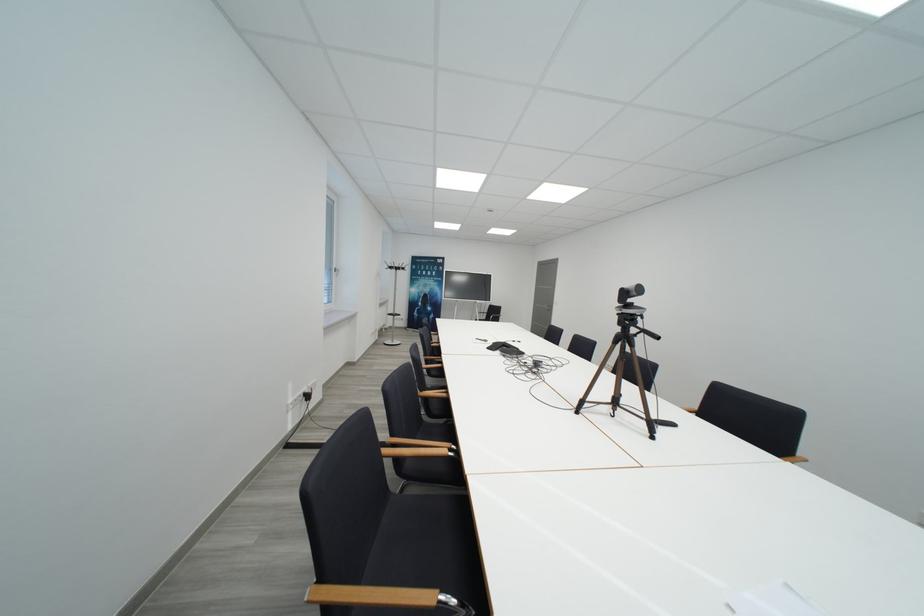
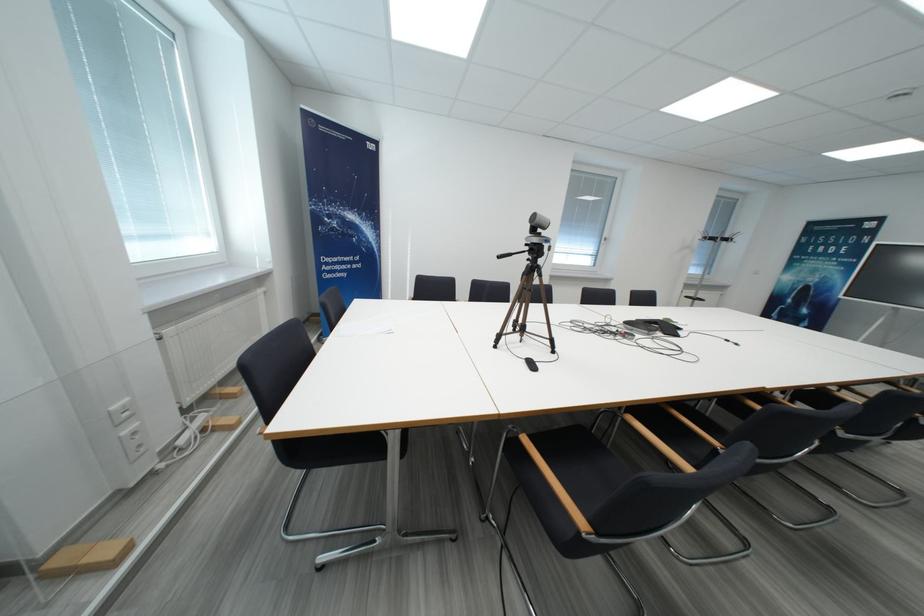
Question: I am providing you with two images of the same scene from different viewpoints. Which of the following objects are not visible in image2?

Choices:
 (A) wooden chair armrest
 (B) black chair sitting surface
 (C) black remote control
 (D) dishwasher control dial

Answer: (B)